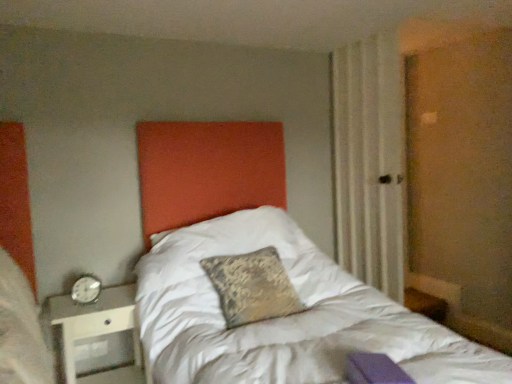
Identify the location of silver metallic alarm clock at left. (86, 289).

This screenshot has width=512, height=384. Describe the element at coordinates (369, 161) in the screenshot. I see `beige textured curtain at right` at that location.

Locate an element on the screen. Image resolution: width=512 pixels, height=384 pixels. metallic silver nightstand at lower left is located at coordinates (94, 322).

You are a GUI agent. You are given a task and a screenshot of the screen. Output one action in this format:
    pyautogui.click(x=<x>, y=<y>)
    Task: Click on the silver metallic alarm clock at left
    This screenshot has height=384, width=512.
    Given the screenshot: What is the action you would take?
    pyautogui.click(x=86, y=289)

Could you tell me if silver metallic alarm clock at left is facing beige textured curtain at right?

No, silver metallic alarm clock at left does not turn towards beige textured curtain at right.

From the image's perspective, which one is positioned higher, silver metallic alarm clock at left or beige textured curtain at right?

beige textured curtain at right.

Does point (82, 290) appear closer or farther from the camera than point (349, 99)?

Point (82, 290).

Based on the photo, is the depth of silver metallic alarm clock at left greater than that of beige textured curtain at right?

No, silver metallic alarm clock at left is in front of beige textured curtain at right.

Does beige textured curtain at right appear on the left side of silver metallic alarm clock at left?

In fact, beige textured curtain at right is to the right of silver metallic alarm clock at left.

In terms of height, does beige textured curtain at right look taller or shorter compared to silver metallic alarm clock at left?

Considering their sizes, beige textured curtain at right has more height than silver metallic alarm clock at left.

From the image's perspective, is beige textured curtain at right above silver metallic alarm clock at left?

Yes.

From a real-world perspective, which object rests below the other?

silver metallic alarm clock at left, from a real-world perspective.

Would you say metallic silver nightstand at lower left is to the left or to the right of silver metallic alarm clock at left in the picture?

From the image, it's evident that metallic silver nightstand at lower left is to the right of silver metallic alarm clock at left.

Do you think metallic silver nightstand at lower left is within silver metallic alarm clock at left, or outside of it?

metallic silver nightstand at lower left is located beyond the bounds of silver metallic alarm clock at left.

Based on the photo, which object is thinner, metallic silver nightstand at lower left or silver metallic alarm clock at left?

silver metallic alarm clock at left is thinner.

Consider the image. Which point is more distant from viewer, (103, 300) or (86, 284)?

Positioned behind is point (103, 300).

Considering the positions of objects beige textured curtain at right and metallic silver nightstand at lower left in the image provided, who is behind, beige textured curtain at right or metallic silver nightstand at lower left?

beige textured curtain at right is more distant.

Based on the photo, can you tell me how much beige textured curtain at right and metallic silver nightstand at lower left differ in facing direction?

The facing directions of beige textured curtain at right and metallic silver nightstand at lower left are 86.2 degrees apart.

Considering the sizes of beige textured curtain at right and metallic silver nightstand at lower left in the image, is beige textured curtain at right taller or shorter than metallic silver nightstand at lower left?

beige textured curtain at right is taller than metallic silver nightstand at lower left.

Is beige textured curtain at right outside of metallic silver nightstand at lower left?

Yes, beige textured curtain at right is located beyond the bounds of metallic silver nightstand at lower left.

From the image's perspective, is metallic silver nightstand at lower left above or below beige textured curtain at right?

From the image's perspective, metallic silver nightstand at lower left appears below beige textured curtain at right.

Consider the image. From a real-world perspective, which is physically above, metallic silver nightstand at lower left or beige textured curtain at right?

beige textured curtain at right.

How many degrees apart are the facing directions of metallic silver nightstand at lower left and beige textured curtain at right?

metallic silver nightstand at lower left and beige textured curtain at right are facing 86.2 degrees away from each other.

From a real-world perspective, which is physically below, silver metallic alarm clock at left or metallic silver nightstand at lower left?

From a 3D spatial view, metallic silver nightstand at lower left is below.

Could you tell me if silver metallic alarm clock at left is facing metallic silver nightstand at lower left?

No, silver metallic alarm clock at left does not turn towards metallic silver nightstand at lower left.

From the image's perspective, is silver metallic alarm clock at left located above metallic silver nightstand at lower left?

Yes.

Looking at this image, is silver metallic alarm clock at left to the left of metallic silver nightstand at lower left from the viewer's perspective?

Yes, silver metallic alarm clock at left is to the left of metallic silver nightstand at lower left.

The image size is (512, 384). What are the coordinates of `curtain above the silver metallic alarm clock at left (from a real-world perspective)` in the screenshot? It's located at [x=369, y=161].

The height and width of the screenshot is (384, 512). I want to click on alarm clock located below the beige textured curtain at right (from the image's perspective), so click(x=86, y=289).

Based on their spatial positions, is silver metallic alarm clock at left or metallic silver nightstand at lower left further from beige textured curtain at right?

Based on the image, silver metallic alarm clock at left appears to be further to beige textured curtain at right.

Based on their spatial positions, is metallic silver nightstand at lower left or beige textured curtain at right further from silver metallic alarm clock at left?

beige textured curtain at right lies further to silver metallic alarm clock at left than the other object.

From the image, which object appears to be farther from silver metallic alarm clock at left, beige textured curtain at right or metallic silver nightstand at lower left?

Based on the image, beige textured curtain at right appears to be further to silver metallic alarm clock at left.

Which object lies nearer to the anchor point metallic silver nightstand at lower left, beige textured curtain at right or silver metallic alarm clock at left?

Among the two, silver metallic alarm clock at left is located nearer to metallic silver nightstand at lower left.

From the image, which object appears to be farther from beige textured curtain at right, metallic silver nightstand at lower left or silver metallic alarm clock at left?

Among the two, silver metallic alarm clock at left is located further to beige textured curtain at right.

Looking at the image, which one is located closer to metallic silver nightstand at lower left, silver metallic alarm clock at left or beige textured curtain at right?

silver metallic alarm clock at left.

The width and height of the screenshot is (512, 384). Find the location of `nightstand located between silver metallic alarm clock at left and beige textured curtain at right in the left-right direction`. nightstand located between silver metallic alarm clock at left and beige textured curtain at right in the left-right direction is located at coordinates point(94,322).